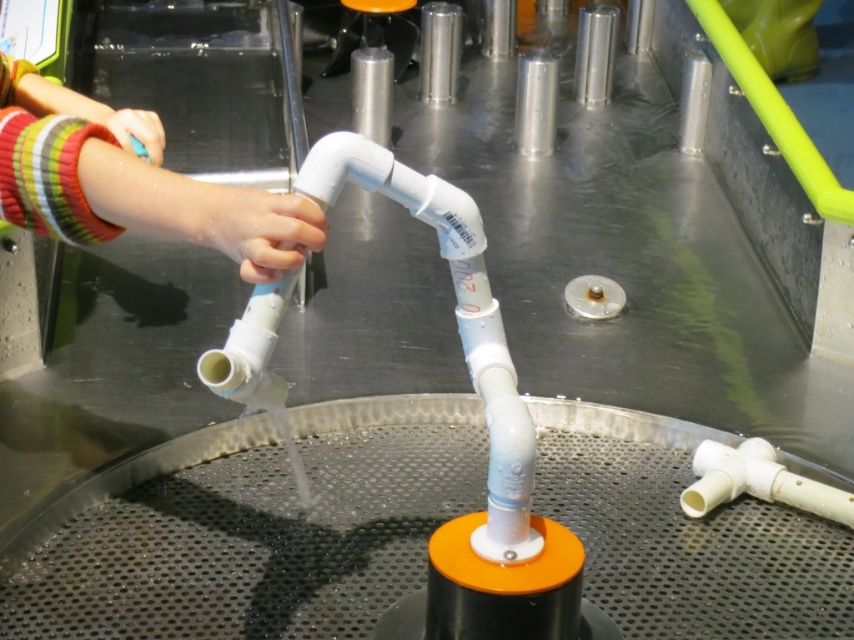
You are a child trying to reach the white matte hand at center and the matte plastic hand at upper left during a science activity. Which hand is closer to the ground?

The white matte hand at center is closer to the ground because it is located below the matte plastic hand at upper left.

You are a maintenance worker at the science center. You need to inspect the two points where the pipes connect to the perforated base. The first point is at coordinates point (208, 220) and the second is at point (89, 116). Which point is closer to you when you face the exhibit?

Point (208, 220) is in front of point (89, 116), so it is closer to you when you face the exhibit.

You are a child trying to fit your hand into the space between the white matte hand at center and the matte plastic hand at upper left. Can you tell me which hand is thinner so you can choose the correct one to place your hand?

The white matte hand at center is thinner than the matte plastic hand at upper left, so you should choose the white matte hand at center to place your hand as it offers a narrower space.